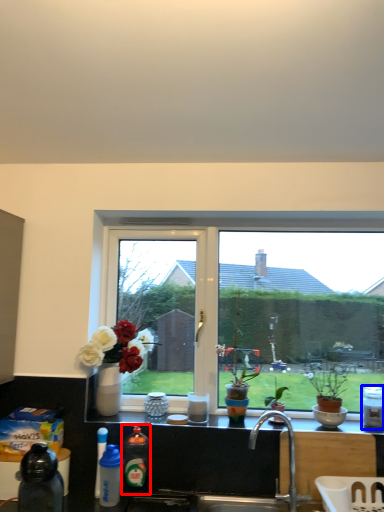
Question: Which of the following is the farthest to the observer, bottle (highlighted by a red box) or bottle (highlighted by a blue box)?

Choices:
 (A) bottle
 (B) bottle

Answer: (B)